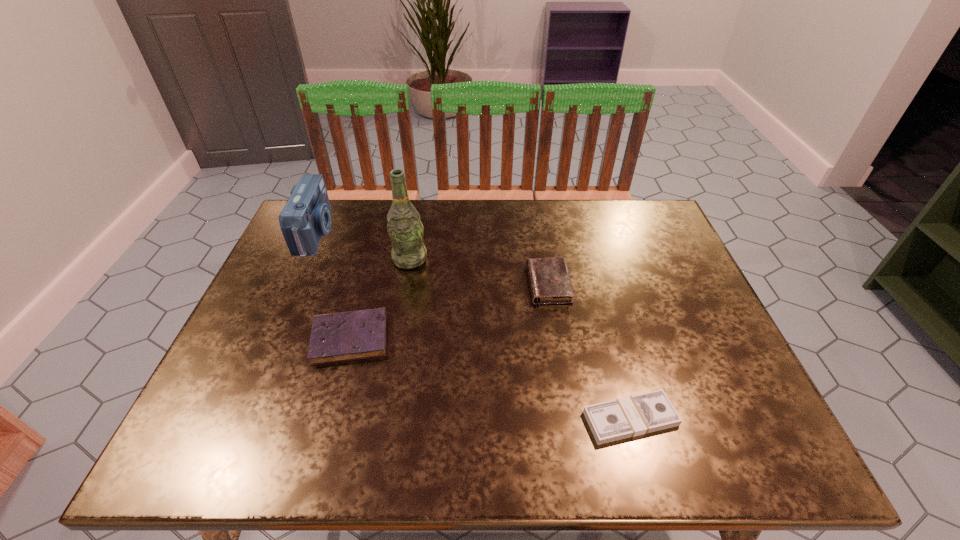
Image resolution: width=960 pixels, height=540 pixels. Find the location of `vacant space located 0.350m on the front of the right diary`. vacant space located 0.350m on the front of the right diary is located at coordinates (574, 437).

What are the coordinates of `free location located on the back of the fourth tallest object` in the screenshot? It's located at (381, 224).

You are a GUI agent. You are given a task and a screenshot of the screen. Output one action in this format:
    pyautogui.click(x=<x>, y=<y>)
    Task: Click on the vacant space located on the back of the dollar
    The image size is (960, 540).
    Given the screenshot: What is the action you would take?
    pyautogui.click(x=602, y=313)

Locate an element on the screen. This screenshot has width=960, height=540. object that is positioned at the far edge is located at coordinates (306, 216).

Locate an element on the screen. The height and width of the screenshot is (540, 960). object located in the near edge section of the desktop is located at coordinates (631, 416).

You are a GUI agent. You are given a task and a screenshot of the screen. Output one action in this format:
    pyautogui.click(x=<x>, y=<y>)
    Task: Click on the object situated at the left edge
    Image resolution: width=960 pixels, height=540 pixels.
    Given the screenshot: What is the action you would take?
    pyautogui.click(x=306, y=216)

At what (x,y) coordinates should I click in order to perform the action: click on object that is at the far left corner. Please return your answer as a coordinate pair (x, y). This screenshot has height=540, width=960. Looking at the image, I should click on (306, 216).

The width and height of the screenshot is (960, 540). I want to click on vacant position at the far edge of the desktop, so click(x=547, y=219).

I want to click on vacant region at the near edge of the desktop, so click(321, 443).

Where is `free spot at the left edge of the desktop`? free spot at the left edge of the desktop is located at coordinates (243, 371).